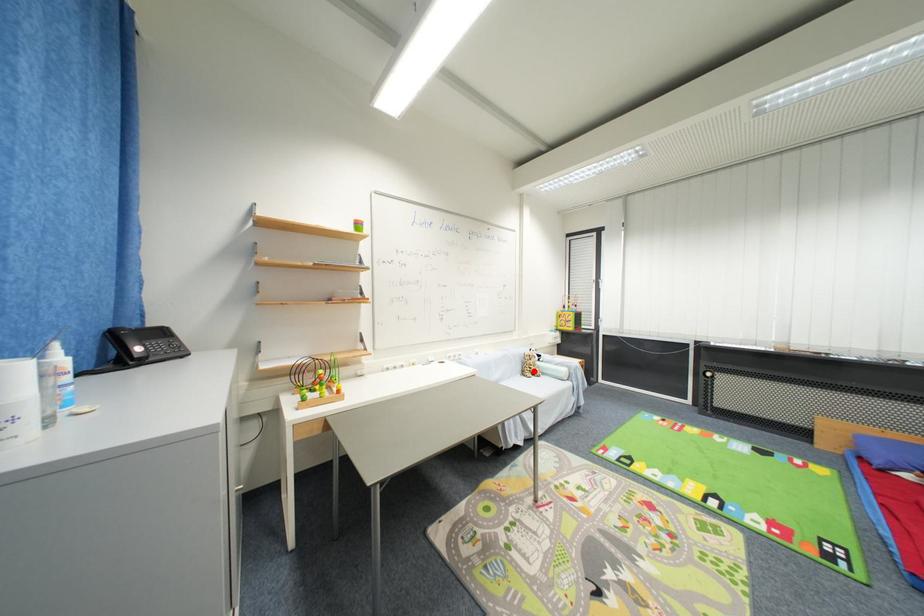
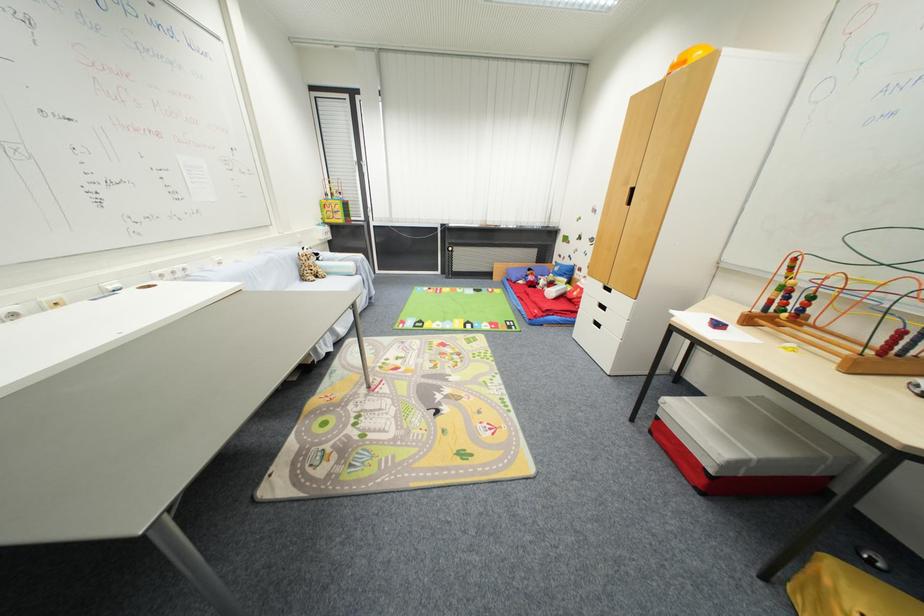
Where in the second image is the point corresponding to the highlighted location from the first image?

(313, 274)